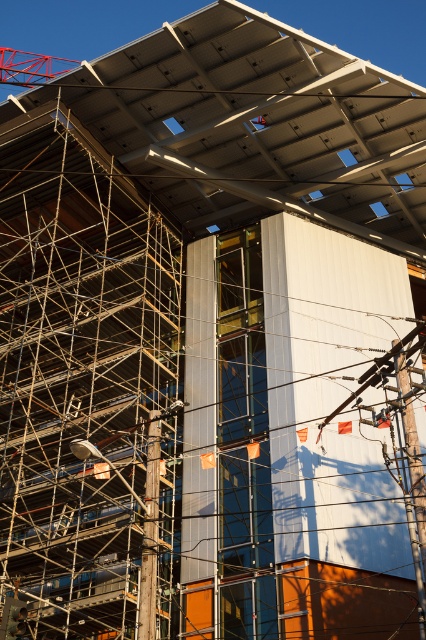
This screenshot has width=426, height=640. What do you see at coordinates (78, 372) in the screenshot? I see `metallic scaffolding at left` at bounding box center [78, 372].

Does metallic scaffolding at left have a lesser width compared to metallic red crane at upper left?

Yes, metallic scaffolding at left is thinner than metallic red crane at upper left.

Is point (3, 438) behind point (40, 58)?

No, it is not.

Where is `metallic scaffolding at left`? metallic scaffolding at left is located at coordinates (78, 372).